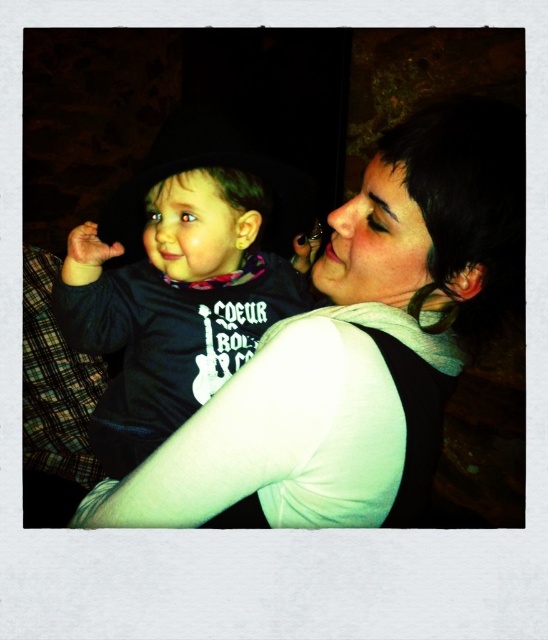
Between matte black shirt at center and matte black hoodie at center, which one is positioned higher?

Positioned higher is matte black hoodie at center.

The image size is (548, 640). Describe the element at coordinates (358, 346) in the screenshot. I see `matte black shirt at center` at that location.

In order to click on matte black shirt at center in this screenshot , I will do `click(358, 346)`.